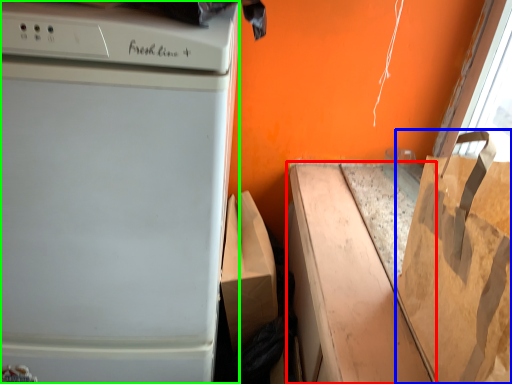
Question: Estimate the real-world distances between objects in this image. Which object is farther from cardboard box (highlighted by a red box), grocery bag (highlighted by a blue box) or home appliance (highlighted by a green box)?

Choices:
 (A) grocery bag
 (B) home appliance

Answer: (B)